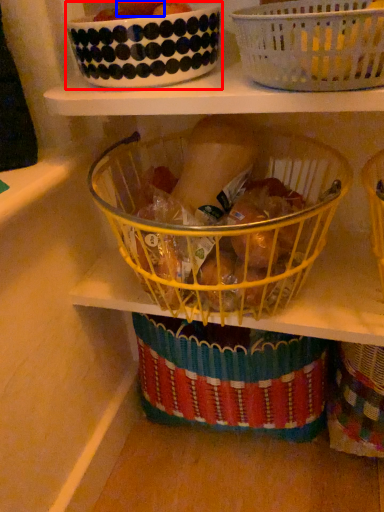
Question: Which object appears farthest to the camera in this image, glass bowl (highlighted by a red box) or fruit (highlighted by a blue box)?

Choices:
 (A) glass bowl
 (B) fruit

Answer: (B)